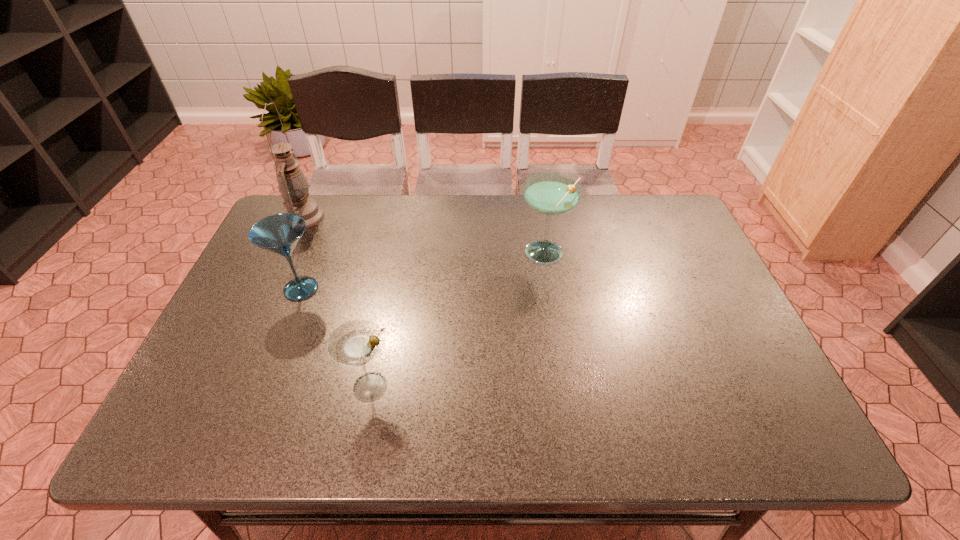
Find the location of a particular element. This screenshot has width=960, height=540. object that stands as the second closest to the leftmost martini is located at coordinates (355, 343).

Locate which martini ranks second in proximity to the rightmost martini. Please provide its 2D coordinates. Your answer should be formatted as a tuple, i.e. [(x, y)], where the tuple contains the x and y coordinates of a point satisfying the conditions above.

[(280, 233)]

Locate which martini ranks second in proximity to the farthest object. Please provide its 2D coordinates. Your answer should be formatted as a tuple, i.e. [(x, y)], where the tuple contains the x and y coordinates of a point satisfying the conditions above.

[(355, 343)]

Image resolution: width=960 pixels, height=540 pixels. Identify the location of vacant space that satisfies the following two spatial constraints: 1. on the front side of the tallest object; 2. on the left side of the leftmost martini. click(271, 289).

Find the location of a particular element. The image size is (960, 540). free location that satisfies the following two spatial constraints: 1. on the front side of the leftmost martini; 2. on the left side of the nearest object is located at coordinates (263, 387).